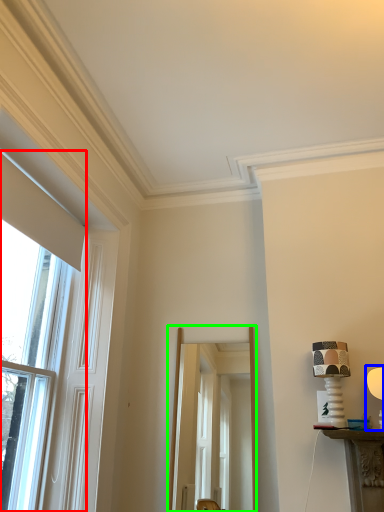
Question: Which is farther away from window (highlighted by a red box)? table lamp (highlighted by a blue box) or screen door (highlighted by a green box)?

Choices:
 (A) table lamp
 (B) screen door

Answer: (A)